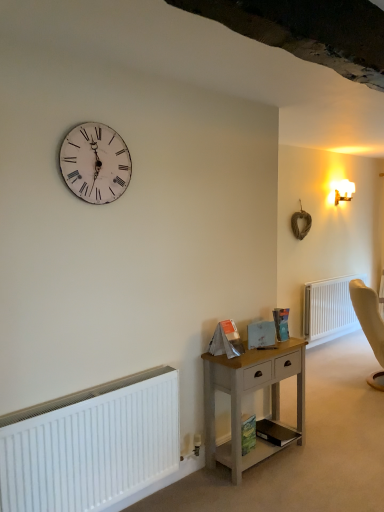
Question: Would you say hardcover book at center, which is counted as the first book, starting from the top, is to the left or to the right of white plastic radiator at lower right, acting as the 2th radiator starting from the left, in the picture?

Choices:
 (A) right
 (B) left

Answer: (B)

Question: Considering their positions, is hardcover book at center, which is counted as the first book, starting from the top, located in front of or behind white plastic radiator at lower right, acting as the 2th radiator starting from the left?

Choices:
 (A) front
 (B) behind

Answer: (A)

Question: Estimate the real-world distances between objects in this image. Which object is farther from the white plastic radiator at lower right, placed as the second radiator when sorted from front to back?

Choices:
 (A) white frosted glass sconce at upper right
 (B) white matte radiator at lower left, the first radiator from the left
 (C) green matte book at lower center, marked as the second book in a bottom-to-top arrangement
 (D) black matte book at lower center, marked as the 3th book in a top-to-bottom arrangement
 (E) white distressed wood clock at upper left

Answer: (E)

Question: Which is farther from the hardcover book at center, which is counted as the first book, starting from the top?

Choices:
 (A) white frosted glass sconce at upper right
 (B) white matte radiator at lower left, which ranks as the second radiator in right-to-left order
 (C) light wood nightstand at lower center
 (D) black matte book at lower center, positioned as the first book in bottom-to-top order
 (E) white distressed wood clock at upper left

Answer: (A)